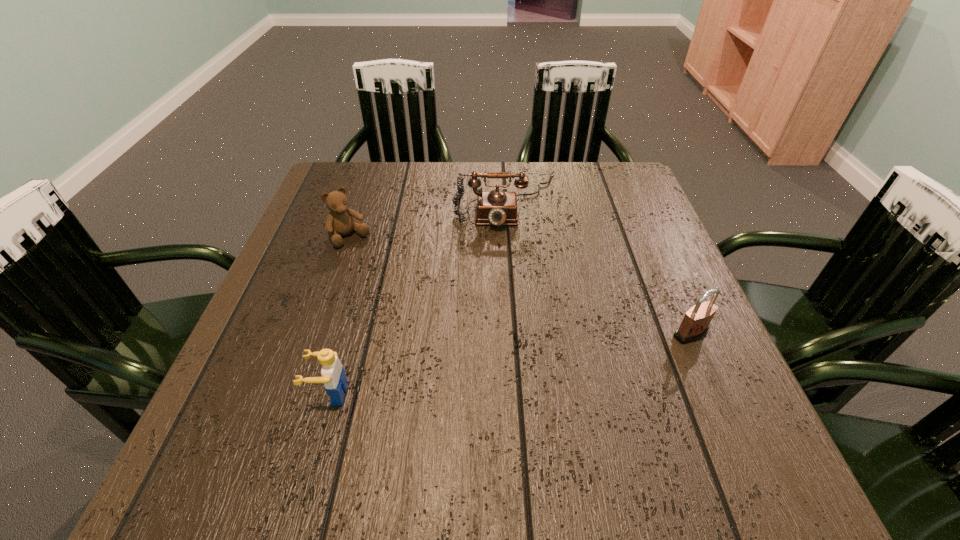
Locate an element on the screen. The image size is (960, 540). the nearest object is located at coordinates (333, 374).

The height and width of the screenshot is (540, 960). I want to click on padlock, so click(x=695, y=324).

Find the location of a particular element. the rightmost object is located at coordinates (695, 324).

This screenshot has width=960, height=540. I want to click on telephone, so click(496, 207).

Where is `teddy bear`? Image resolution: width=960 pixels, height=540 pixels. teddy bear is located at coordinates (339, 222).

This screenshot has height=540, width=960. Find the location of `vacant space located 0.160m on the face of the Lego`. vacant space located 0.160m on the face of the Lego is located at coordinates (220, 394).

Where is `vacant point located on the back of the padlock`? The height and width of the screenshot is (540, 960). vacant point located on the back of the padlock is located at coordinates (644, 228).

Image resolution: width=960 pixels, height=540 pixels. What are the coordinates of `free space located 0.230m on the dial of the telephone` in the screenshot? It's located at (513, 301).

The width and height of the screenshot is (960, 540). Identify the location of vacant space positioned 0.120m on the dial of the telephone. (511, 266).

You are a GUI agent. You are given a task and a screenshot of the screen. Output one action in this format:
    pyautogui.click(x=<x>, y=<y>)
    Task: Click on the vacant space located 0.080m on the dial of the telephone
    The height and width of the screenshot is (540, 960).
    Given the screenshot: What is the action you would take?
    pyautogui.click(x=510, y=254)